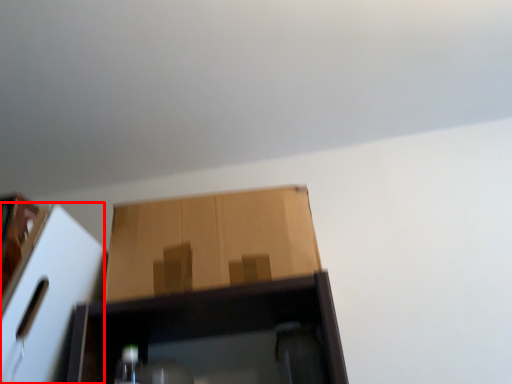
Question: From the image's perspective, considering the relative positions of cardboard box (annotated by the red box) and cardboard box in the image provided, where is cardboard box (annotated by the red box) located with respect to the staircase?

Choices:
 (A) below
 (B) above

Answer: (A)